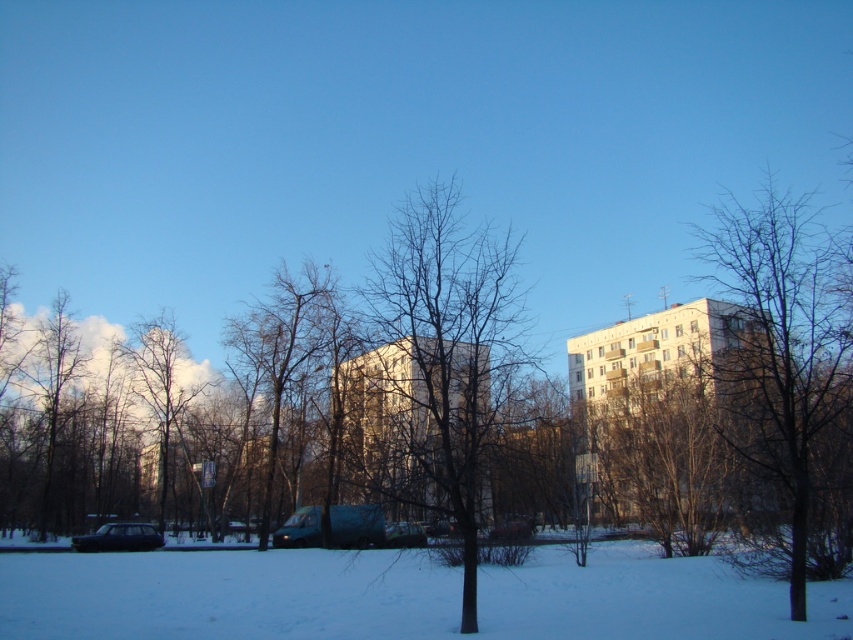
Question: Based on their relative distances, which object is farther from the metallic blue van at center?

Choices:
 (A) bare branches at center
 (B) shiny black car at lower left

Answer: (B)

Question: Is white powdery snow at lower center below bare branches at center?

Choices:
 (A) yes
 (B) no

Answer: (A)

Question: Is bare branches at right above metallic blue van at center?

Choices:
 (A) no
 (B) yes

Answer: (B)

Question: Which object is farther from the camera taking this photo?

Choices:
 (A) metallic green van at center
 (B) metallic blue van at center
 (C) bare branches at center

Answer: (B)

Question: In this image, where is white powdery snow at lower center located relative to metallic blue van at center?

Choices:
 (A) right
 (B) left

Answer: (A)

Question: Which point appears farthest from the camera in this image?

Choices:
 (A) (483, 332)
 (B) (138, 536)
 (C) (763, 397)

Answer: (B)